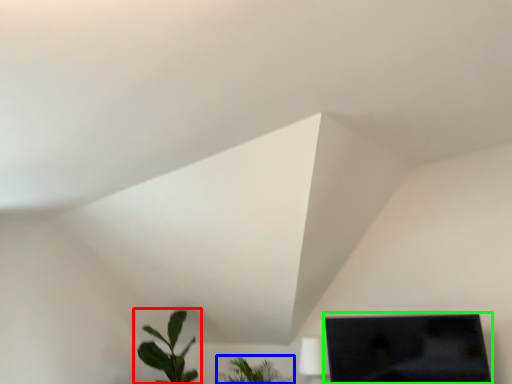
Question: Considering the real-world distances, which object is farthest from houseplant (highlighted by a red box)? houseplant (highlighted by a blue box) or computer monitor (highlighted by a green box)?

Choices:
 (A) houseplant
 (B) computer monitor

Answer: (B)